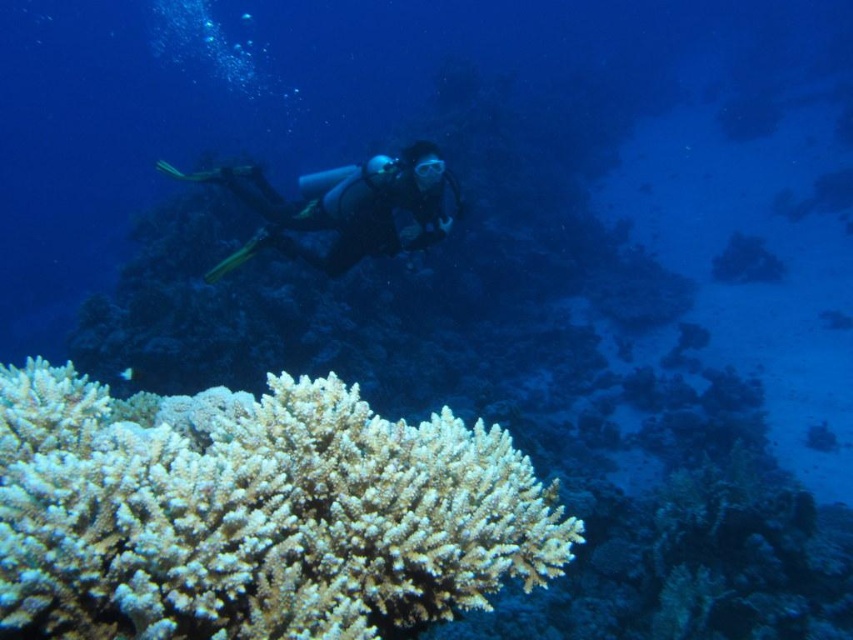
Question: Can you confirm if white coral at lower left is wider than black matte scuba diver at center?

Choices:
 (A) yes
 (B) no

Answer: (B)

Question: Is white coral at lower left bigger than black matte scuba diver at center?

Choices:
 (A) yes
 (B) no

Answer: (B)

Question: Which point appears closest to the camera in this image?

Choices:
 (A) (213, 417)
 (B) (271, 195)

Answer: (A)

Question: Which object is farther from the camera taking this photo?

Choices:
 (A) white coral at lower left
 (B) black matte scuba diver at center

Answer: (B)

Question: Can you confirm if white coral at lower left is positioned above black matte scuba diver at center?

Choices:
 (A) no
 (B) yes

Answer: (A)